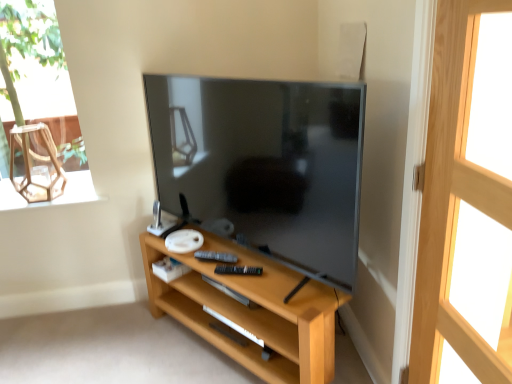
Locate an element on the screen. This screenshot has height=384, width=512. blank space above light wood shelf at center (from a real-world perspective) is located at coordinates (236, 261).